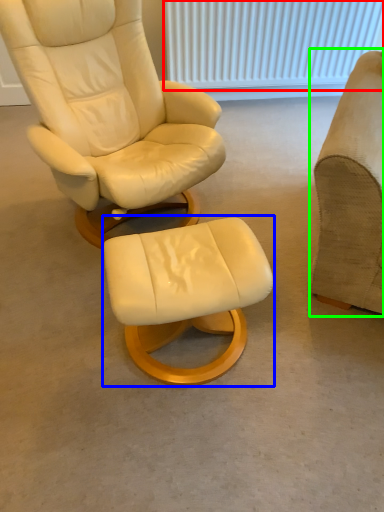
Question: Which is nearer to the radiator (highlighted by a red box)? stool (highlighted by a blue box) or chair (highlighted by a green box).

Choices:
 (A) stool
 (B) chair

Answer: (B)